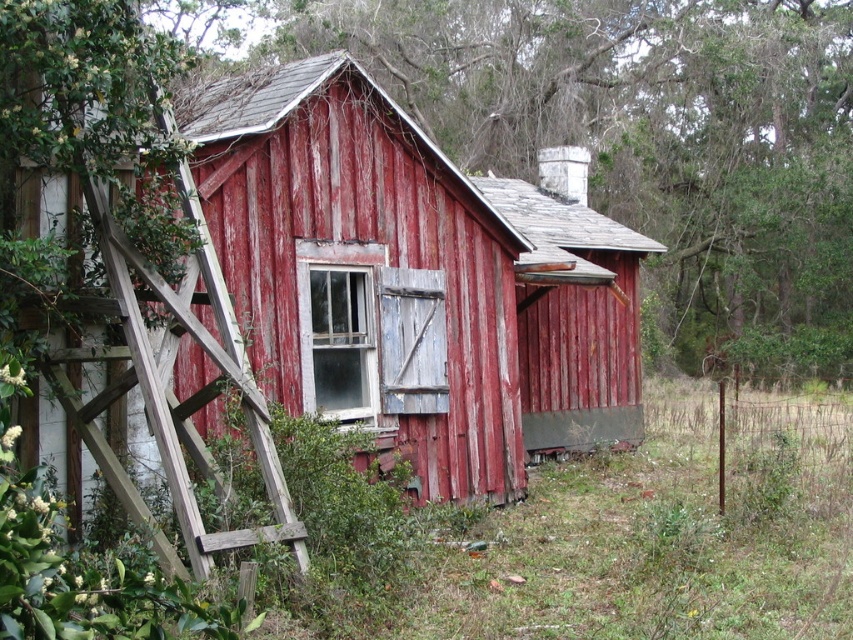
Question: Which point is farther from the camera taking this photo?

Choices:
 (A) (242, 376)
 (B) (410, 77)
 (C) (572, 376)

Answer: (B)

Question: In this image, where is smooth wooden fence at center located relative to weathered wood ladder at left?

Choices:
 (A) right
 (B) left

Answer: (A)

Question: Is smooth wooden fence at center to the left of weathered wood ladder at left from the viewer's perspective?

Choices:
 (A) no
 (B) yes

Answer: (A)

Question: Which is nearer to the rusty wood barn at center?

Choices:
 (A) smooth wooden fence at center
 (B) weathered wood ladder at left

Answer: (B)

Question: Among these points, which one is nearest to the camera?

Choices:
 (A) (840, 266)
 (B) (181, 500)
 (C) (259, 99)

Answer: (B)

Question: Can you confirm if rusty wood barn at center is smaller than smooth wooden fence at center?

Choices:
 (A) yes
 (B) no

Answer: (A)